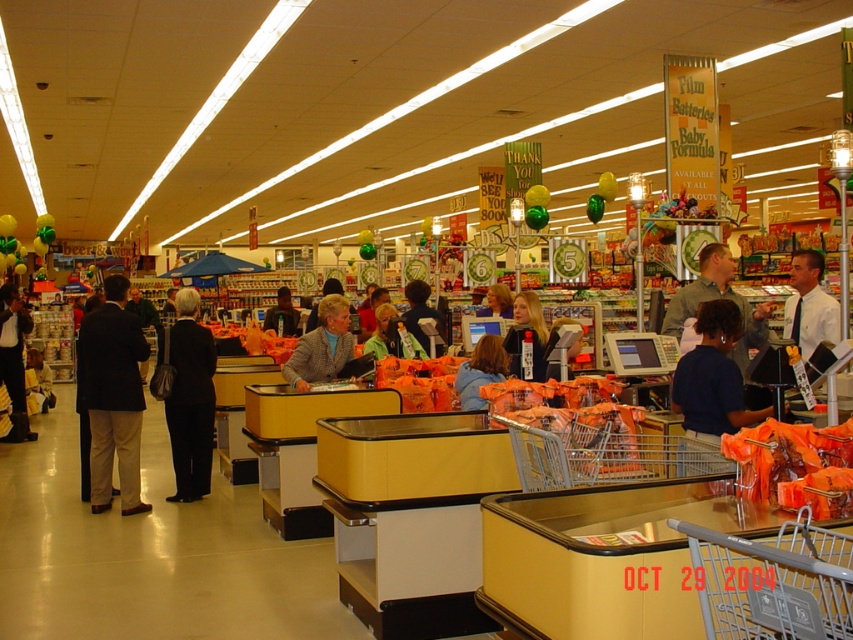
You are a grocery store employee who needs to move the gray plastic shopping cart at lower right and the black fabric coat at center to clear a path for a delivery cart that is 2 meters wide. Based on their sizes, which object should you move first to make the most efficient use of space?

The gray plastic shopping cart at lower right occupies less space than the black fabric coat at center, so you should move the black fabric coat at center first to free up more space efficiently.

You are a customer trying to decide whether to place your black fabric coat at center into the gray plastic shopping cart at lower right. Based on their sizes, will the coat fit inside the cart?

The gray plastic shopping cart at lower right is shorter than the black fabric coat at center, so the coat may not fit inside the cart due to the cart being shorter in height.

You are a customer at the checkout area and want to know which point is closer to you. The points are point (473, 378) and point (270, 328). Which one is closer?

Point (473, 378) is closer to the viewer than point (270, 328).